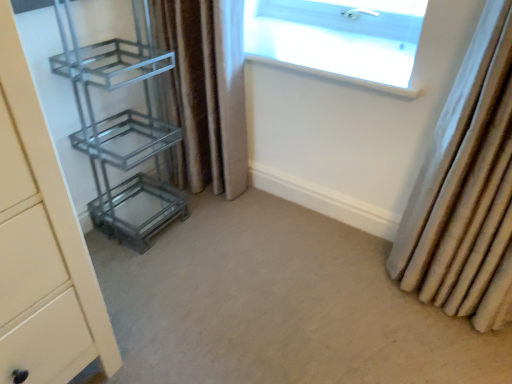
Where is `free point to the left of beige fabric curtain at right, marked as the second curtain in a left-to-right arrangement`? This screenshot has height=384, width=512. free point to the left of beige fabric curtain at right, marked as the second curtain in a left-to-right arrangement is located at coordinates (356, 290).